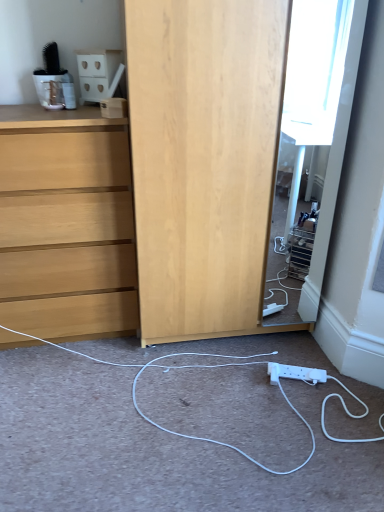
Question: Does white matte cabinet at upper left appear on the left side of light wood chest of drawers at left?

Choices:
 (A) no
 (B) yes

Answer: (A)

Question: Is white matte cabinet at upper left not within light wood chest of drawers at left?

Choices:
 (A) no
 (B) yes

Answer: (B)

Question: Does white matte cabinet at upper left turn towards light wood chest of drawers at left?

Choices:
 (A) no
 (B) yes

Answer: (A)

Question: Is light wood chest of drawers at left completely or partially inside white matte cabinet at upper left?

Choices:
 (A) no
 (B) yes

Answer: (A)

Question: Is white matte cabinet at upper left facing away from light wood chest of drawers at left?

Choices:
 (A) yes
 (B) no

Answer: (B)

Question: From a real-world perspective, is white plastic power strip at lower center physically located above or below white matte cabinet at upper left?

Choices:
 (A) below
 (B) above

Answer: (A)

Question: Based on their sizes in the image, would you say white plastic power strip at lower center is bigger or smaller than white matte cabinet at upper left?

Choices:
 (A) big
 (B) small

Answer: (A)

Question: Is white plastic power strip at lower center taller or shorter than white matte cabinet at upper left?

Choices:
 (A) tall
 (B) short

Answer: (B)

Question: Is white plastic power strip at lower center spatially inside white matte cabinet at upper left, or outside of it?

Choices:
 (A) inside
 (B) outside

Answer: (B)

Question: From a real-world perspective, is white matte cabinet at upper left above or below white plastic power strip at lower center?

Choices:
 (A) above
 (B) below

Answer: (A)

Question: Does point (112, 64) appear closer or farther from the camera than point (183, 352)?

Choices:
 (A) farther
 (B) closer

Answer: (B)

Question: Looking at the image, does white matte cabinet at upper left seem bigger or smaller compared to white plastic power strip at lower center?

Choices:
 (A) small
 (B) big

Answer: (A)

Question: Based on their positions, is white matte cabinet at upper left located to the left or right of white plastic power strip at lower center?

Choices:
 (A) right
 (B) left

Answer: (B)

Question: Choose the correct answer: Is white matte cabinet at upper left inside light wood chest of drawers at left or outside it?

Choices:
 (A) inside
 (B) outside

Answer: (B)

Question: Is white matte cabinet at upper left taller or shorter than light wood chest of drawers at left?

Choices:
 (A) short
 (B) tall

Answer: (A)